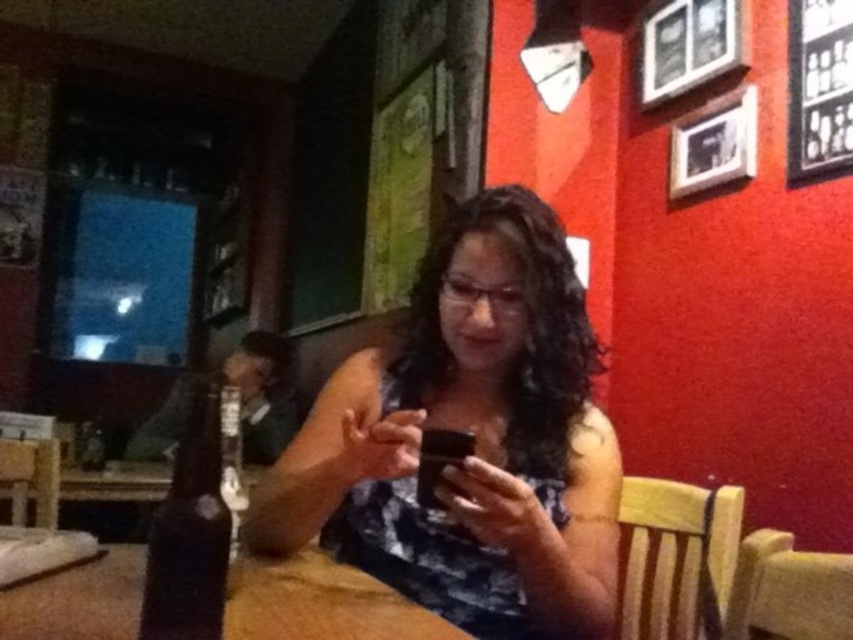
Question: Is matte black phone at center further to the viewer compared to clear glass bottle at center?

Choices:
 (A) no
 (B) yes

Answer: (B)

Question: Where is matte black phone at center located in relation to dark brown glass bottle at lower left in the image?

Choices:
 (A) left
 (B) right

Answer: (B)

Question: Where is matte black phone at center located in relation to clear glass bottle at center in the image?

Choices:
 (A) left
 (B) right

Answer: (B)

Question: Which of the following is the closest to the observer?

Choices:
 (A) clear glass bottle at center
 (B) dark brown glass bottle at lower left

Answer: (B)

Question: Based on their relative distances, which object is farther from the clear glass bottle at center?

Choices:
 (A) brown wood table at center
 (B) matte black phone at center
 (C) dark brown glass bottle at lower left

Answer: (B)

Question: Which of the following is the farthest from the observer?

Choices:
 (A) (35, 636)
 (B) (445, 593)
 (C) (223, 531)

Answer: (B)